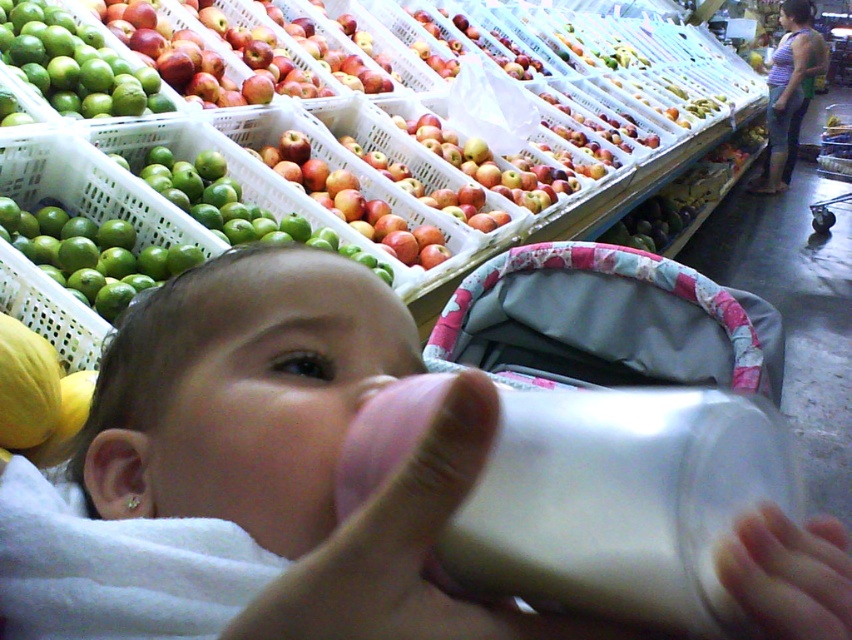
You are a delivery person who needs to place a package at point 0.100, 0.088 in the image. You see the green matte limes at left. Where should you place the package?

You should place the package at the position of the green matte limes at left, which is at point (73, 64).

You are a photographer trying to capture a close shot of the green matte limes at left. Given that your camera lens has a minimum focusing distance of 5 feet, will you need to move closer or farther away to ensure they are in focus?

The green matte limes at left are 5.15 feet away from the camera. Since the minimum focusing distance is 5 feet, you need to move slightly closer to ensure they are in focus.

You are a delivery person who needs to locate the green matte limes at left in the image. According to the coordinates provided, where exactly are they positioned?

The green matte limes at left are positioned at point (73, 64).